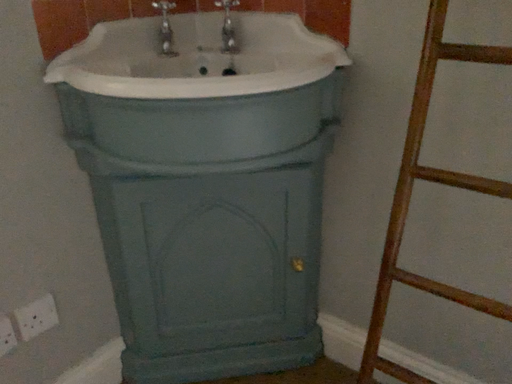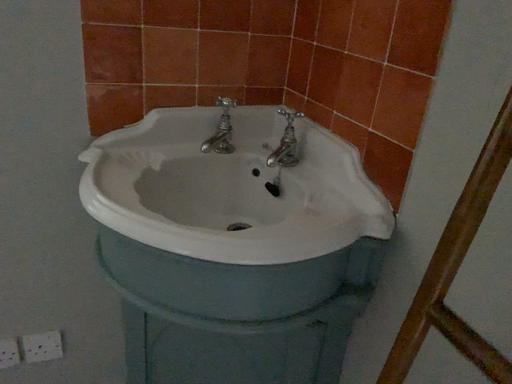
Question: Which way did the camera rotate in the video?

Choices:
 (A) rotated right
 (B) rotated left

Answer: (B)